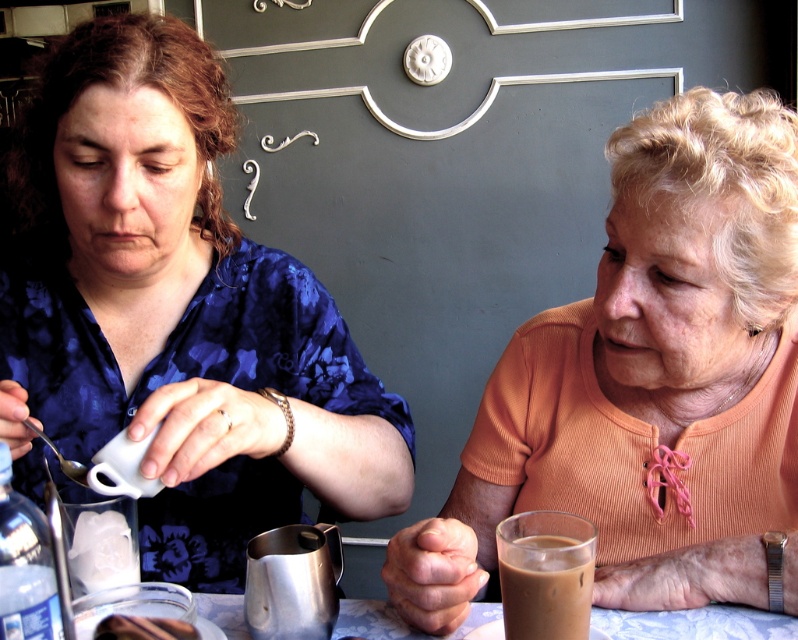
You are a barista trying to pour a brown frothy beverage at lower center into the shiny metallic pitcher at lower center. Can you do this without moving the pitcher? Explain why based on their positions.

The shiny metallic pitcher at lower center is further to the viewer than the brown frothy beverage at lower center. Since the pitcher is closer to you, you can easily pour the beverage into it without needing to move the pitcher.

You are a photographer trying to capture a closeup of the brown frothy beverage at lower center without including the matte blue blouse at upper left in the frame. Given their sizes, do you think this is possible?

The matte blue blouse at upper left is larger than the brown frothy beverage at lower center, so it might be challenging to frame the beverage without including the blouse, but adjusting the camera angle or zoom could help isolate the beverage.